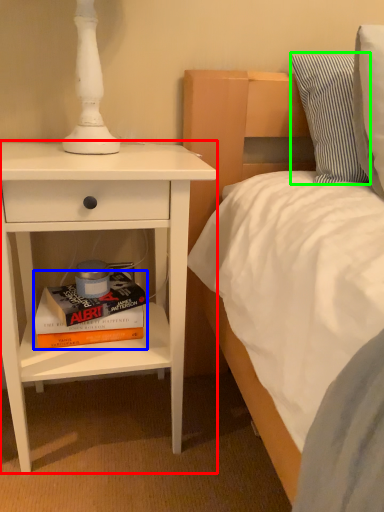
Question: Considering the real-world distances, which object is farthest from nightstand (highlighted by a red box)? book (highlighted by a blue box) or pillow (highlighted by a green box)?

Choices:
 (A) book
 (B) pillow

Answer: (B)